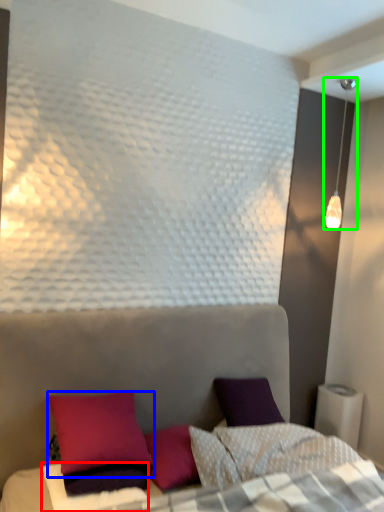
Question: Which object is positioned closest to sheet (highlighted by a red box)? Select from pillow (highlighted by a blue box) and lamp (highlighted by a green box).

Choices:
 (A) pillow
 (B) lamp

Answer: (A)